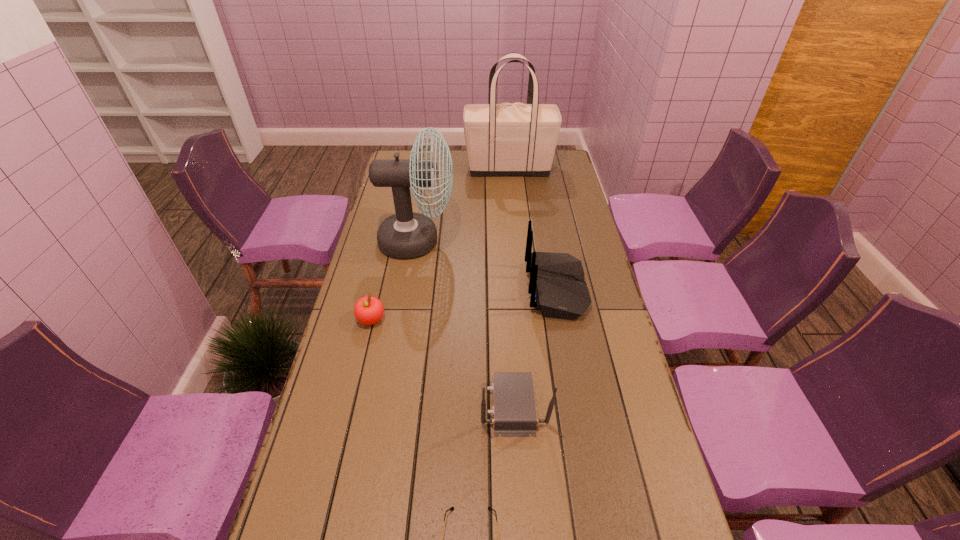
Where is `blank region between the fan and the shopping bag`? The image size is (960, 540). blank region between the fan and the shopping bag is located at coordinates (464, 205).

At what (x,y) coordinates should I click in order to perform the action: click on the third closest object to the farther router. Please return your answer as a coordinate pair (x, y). This screenshot has width=960, height=540. Looking at the image, I should click on (368, 310).

Select which object is the closest to the farther router. Please provide its 2D coordinates. Your answer should be formatted as a tuple, i.e. [(x, y)], where the tuple contains the x and y coordinates of a point satisfying the conditions above.

[(514, 408)]

The width and height of the screenshot is (960, 540). Find the location of `vacant area in the image that satisfies the following two spatial constraints: 1. in front of the fan where the airflow is directed; 2. on the front side of the fifth tallest object`. vacant area in the image that satisfies the following two spatial constraints: 1. in front of the fan where the airflow is directed; 2. on the front side of the fifth tallest object is located at coordinates (404, 320).